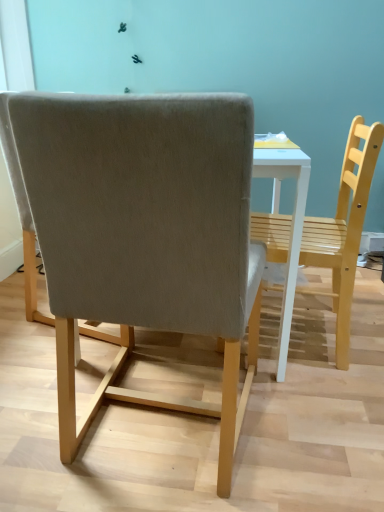
Question: Would you say light gray fabric chair at center, which appears as the second chair when viewed from the right, is to the left or to the right of light brown wooden chair at center, marked as the 1th chair in a right-to-left arrangement, in the picture?

Choices:
 (A) right
 (B) left

Answer: (B)

Question: Is light gray fabric chair at center, which is counted as the 1th chair, starting from the left, taller or shorter than light brown wooden chair at center, the second chair viewed from the left?

Choices:
 (A) tall
 (B) short

Answer: (A)

Question: From a real-world perspective, is light gray fabric chair at center, which appears as the second chair when viewed from the right, positioned above or below light brown wooden chair at center, marked as the 1th chair in a right-to-left arrangement?

Choices:
 (A) above
 (B) below

Answer: (A)

Question: In the image, is light brown wooden chair at center, marked as the 1th chair in a right-to-left arrangement, positioned in front of or behind light gray fabric chair at center, which appears as the second chair when viewed from the right?

Choices:
 (A) front
 (B) behind

Answer: (B)

Question: Is light brown wooden chair at center, marked as the 1th chair in a right-to-left arrangement, taller or shorter than light gray fabric chair at center, which appears as the second chair when viewed from the right?

Choices:
 (A) short
 (B) tall

Answer: (A)

Question: Based on their sizes in the image, would you say light brown wooden chair at center, the second chair viewed from the left, is bigger or smaller than light gray fabric chair at center, which is counted as the 1th chair, starting from the left?

Choices:
 (A) small
 (B) big

Answer: (A)

Question: Considering the positions of point (340, 275) and point (178, 288), is point (340, 275) closer or farther from the camera than point (178, 288)?

Choices:
 (A) farther
 (B) closer

Answer: (A)